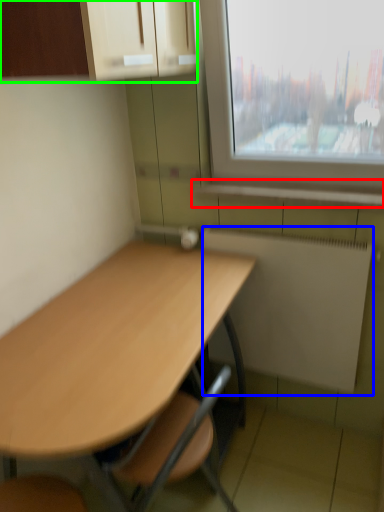
Question: Based on their relative distances, which object is farther from window sill (highlighted by a red box)? Choose from radiator (highlighted by a blue box) and cabinetry (highlighted by a green box).

Choices:
 (A) radiator
 (B) cabinetry

Answer: (B)